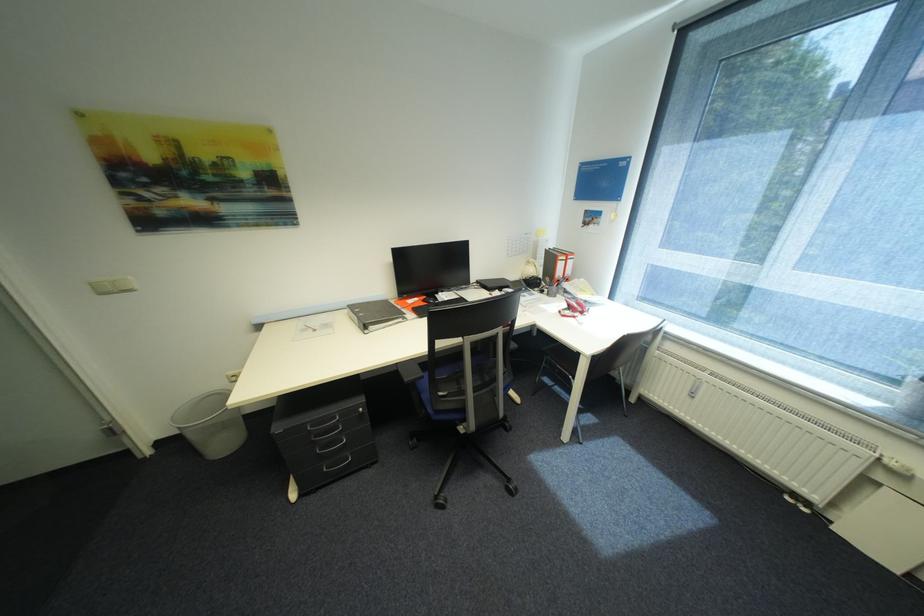
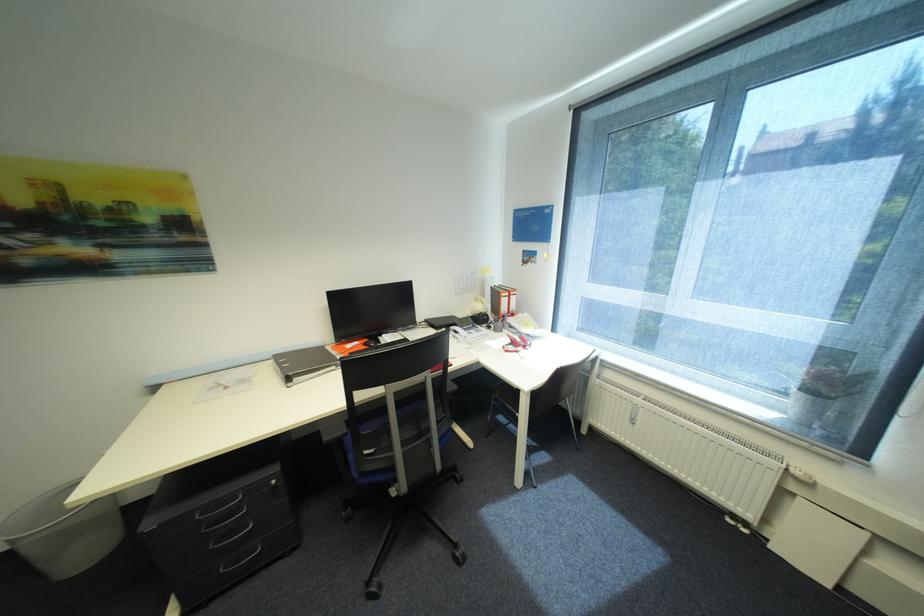
The point at (317, 428) is marked in the first image. Where is the corresponding point in the second image?

(205, 516)